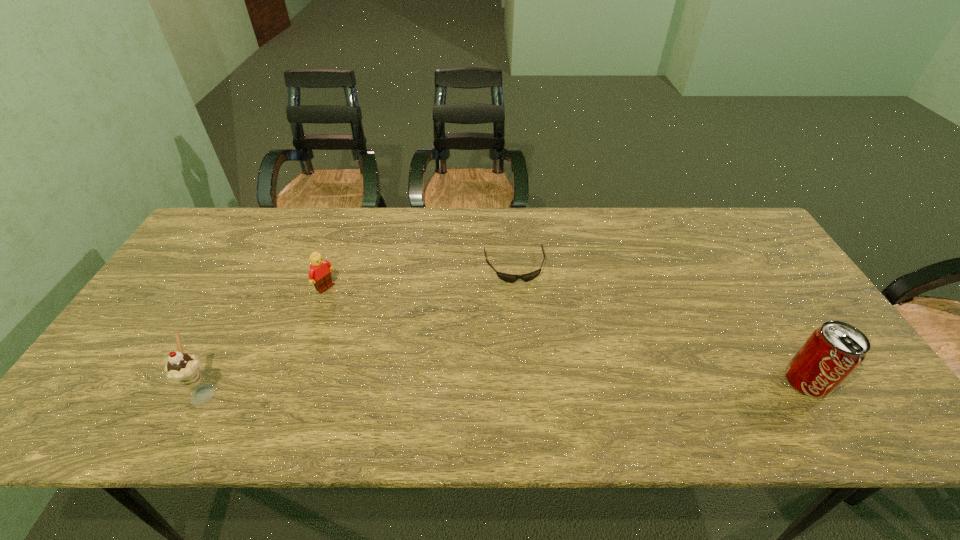
Where is `free space located on the front-facing side of the sunglasses`? The height and width of the screenshot is (540, 960). free space located on the front-facing side of the sunglasses is located at coordinates (521, 296).

The width and height of the screenshot is (960, 540). In order to click on blank space located on the face of the Lego in this screenshot , I will do `click(423, 355)`.

Where is `free space located on the face of the Lego`? This screenshot has width=960, height=540. free space located on the face of the Lego is located at coordinates (423, 355).

Where is `free region located 0.120m on the face of the Lego`? The width and height of the screenshot is (960, 540). free region located 0.120m on the face of the Lego is located at coordinates (360, 312).

Find the location of a particular element. object that is at the far edge is located at coordinates pos(510,278).

The image size is (960, 540). Find the location of `icecream positioned at the near edge`. icecream positioned at the near edge is located at coordinates (183, 368).

You are a GUI agent. You are given a task and a screenshot of the screen. Output one action in this format:
    pyautogui.click(x=<x>, y=<y>)
    Task: Click on the pop soda that is at the near edge
    The height and width of the screenshot is (540, 960).
    Given the screenshot: What is the action you would take?
    pyautogui.click(x=833, y=351)

You are a GUI agent. You are given a task and a screenshot of the screen. Output one action in this format:
    pyautogui.click(x=<x>, y=<y>)
    Task: Click on the object at the right edge
    
    Given the screenshot: What is the action you would take?
    pyautogui.click(x=833, y=351)

The height and width of the screenshot is (540, 960). I want to click on object located in the near right corner section of the desktop, so click(833, 351).

Locate an element on the screen. The image size is (960, 540). vacant space at the far edge is located at coordinates (437, 207).